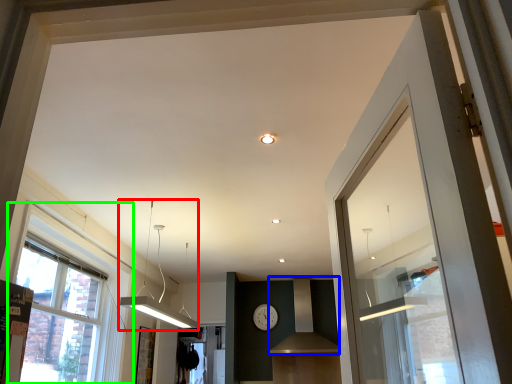
Question: Which is nearer to the light fixture (highlighted by a red box)? vent (highlighted by a blue box) or window (highlighted by a green box).

Choices:
 (A) vent
 (B) window

Answer: (B)